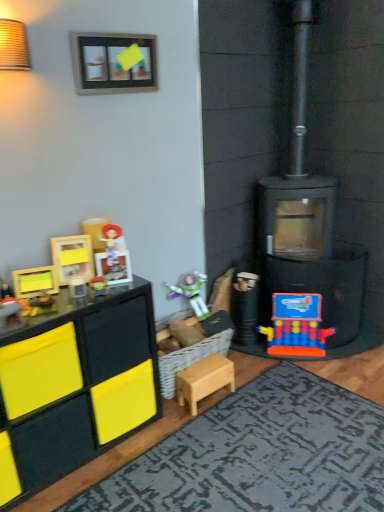
Question: Should I look upward or downward to see orange plastic toy at lower right, placed as the fifth toy when sorted from left to right?

Choices:
 (A) up
 (B) down

Answer: (B)

Question: From the image's perspective, would you say light wood stool at center, which is the second toy from back to front, is shown under textured gray rug at lower center?

Choices:
 (A) no
 (B) yes

Answer: (A)

Question: Is light wood stool at center, which is the 4th toy from left to right, positioned in front of textured gray rug at lower center?

Choices:
 (A) yes
 (B) no

Answer: (B)

Question: Considering the relative sizes of light wood stool at center, which is the second toy from back to front, and textured gray rug at lower center in the image provided, is light wood stool at center, which is the second toy from back to front, bigger than textured gray rug at lower center?

Choices:
 (A) no
 (B) yes

Answer: (A)

Question: Considering the relative sizes of light wood stool at center, which is the second toy from back to front, and textured gray rug at lower center in the image provided, is light wood stool at center, which is the second toy from back to front, taller than textured gray rug at lower center?

Choices:
 (A) no
 (B) yes

Answer: (B)

Question: Can you confirm if light wood stool at center, marked as the 2th toy in a right-to-left arrangement, is positioned to the left of textured gray rug at lower center?

Choices:
 (A) yes
 (B) no

Answer: (A)

Question: Would you say textured gray rug at lower center is part of light wood stool at center, which is the 4th toy from left to right,'s contents?

Choices:
 (A) yes
 (B) no

Answer: (B)

Question: From a real-world perspective, is matte black toy at left, arranged as the 1th toy when viewed from the left, located beneath black matte fireplace at right?

Choices:
 (A) yes
 (B) no

Answer: (A)

Question: Considering the relative sizes of matte black toy at left, arranged as the 5th toy when viewed from the back, and black matte fireplace at right in the image provided, is matte black toy at left, arranged as the 5th toy when viewed from the back, bigger than black matte fireplace at right?

Choices:
 (A) no
 (B) yes

Answer: (A)

Question: Is black matte fireplace at right at the back of matte black toy at left, arranged as the 1th toy when viewed from the left?

Choices:
 (A) yes
 (B) no

Answer: (B)

Question: Is matte black toy at left, placed as the first toy when sorted from front to back, taller than black matte fireplace at right?

Choices:
 (A) yes
 (B) no

Answer: (B)

Question: From the image's perspective, is matte black toy at left, arranged as the 5th toy when viewed from the back, on top of black matte fireplace at right?

Choices:
 (A) no
 (B) yes

Answer: (A)

Question: Is matte black toy at left, arranged as the 5th toy when viewed from the back, smaller than black matte fireplace at right?

Choices:
 (A) yes
 (B) no

Answer: (A)

Question: Is wooden picture frame at upper center turned away from black matte fireplace at right?

Choices:
 (A) yes
 (B) no

Answer: (B)